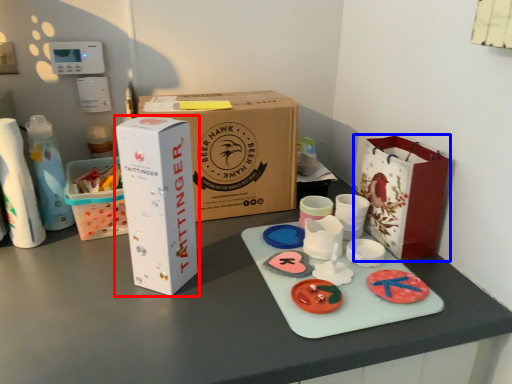
Question: Among these objects, which one is nearest to the camera, box (highlighted by a red box) or paper bag (highlighted by a blue box)?

Choices:
 (A) box
 (B) paper bag

Answer: (A)